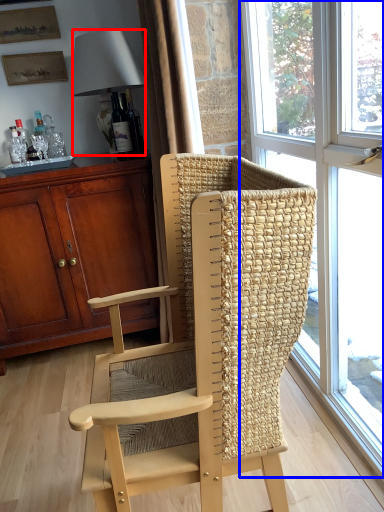
Question: Which of the following is the closest to the observer, lamp (highlighted by a red box) or window (highlighted by a blue box)?

Choices:
 (A) lamp
 (B) window

Answer: (B)